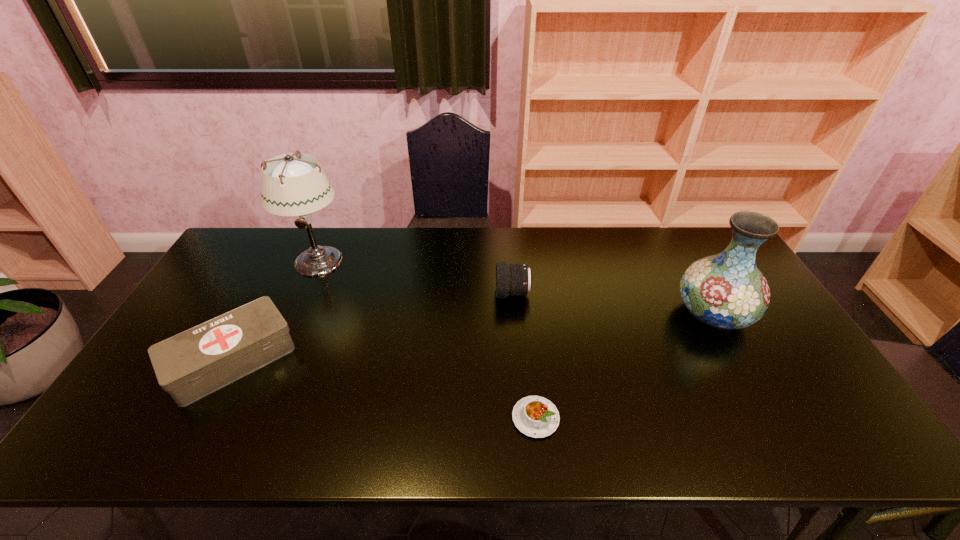
Identify the location of free space at the far left corner of the desktop. Image resolution: width=960 pixels, height=540 pixels. (236, 247).

At what (x,y) coordinates should I click in order to perform the action: click on free spot at the far right corner of the desktop. Please return your answer as a coordinate pair (x, y). This screenshot has width=960, height=540. Looking at the image, I should click on (681, 232).

The width and height of the screenshot is (960, 540). In the image, there is a desktop. What are the coordinates of `vacant region at the near right corner` in the screenshot? It's located at (817, 446).

I want to click on vacant area that lies between the rightmost object and the telephoto lens, so click(612, 303).

Identify the location of unoccupied position between the rightmost object and the second shortest object. (472, 336).

This screenshot has height=540, width=960. Find the location of `free space that is in between the shortest object and the fourth tallest object`. free space that is in between the shortest object and the fourth tallest object is located at coordinates (384, 389).

Image resolution: width=960 pixels, height=540 pixels. Identify the location of free space that is in between the third tallest object and the pudding. (524, 356).

The height and width of the screenshot is (540, 960). What are the coordinates of `free point between the second shortest object and the third shortest object` in the screenshot? It's located at (372, 327).

I want to click on vacant area that lies between the vase and the shortest object, so click(624, 366).

The height and width of the screenshot is (540, 960). In order to click on vacant point located between the pudding and the rightmost object in this screenshot , I will do `click(624, 366)`.